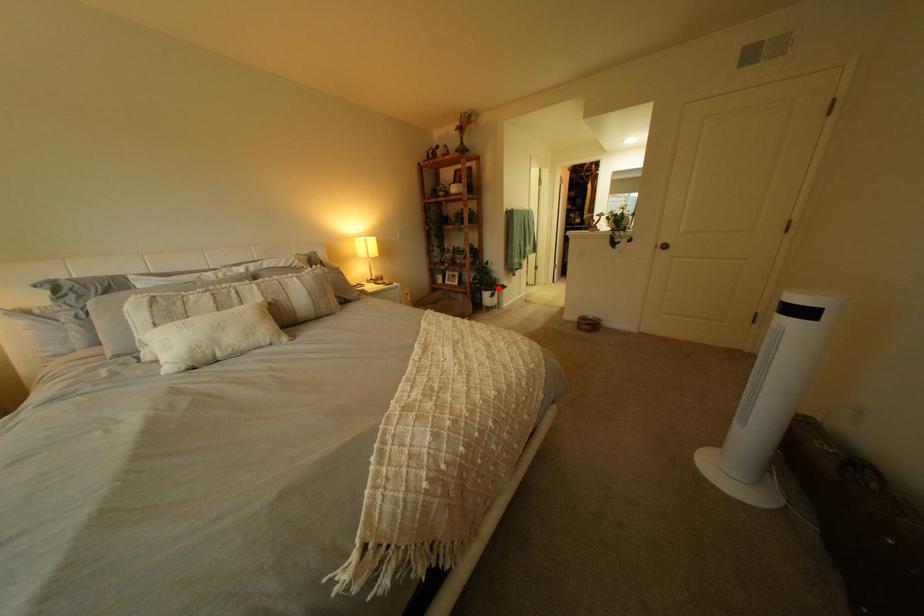
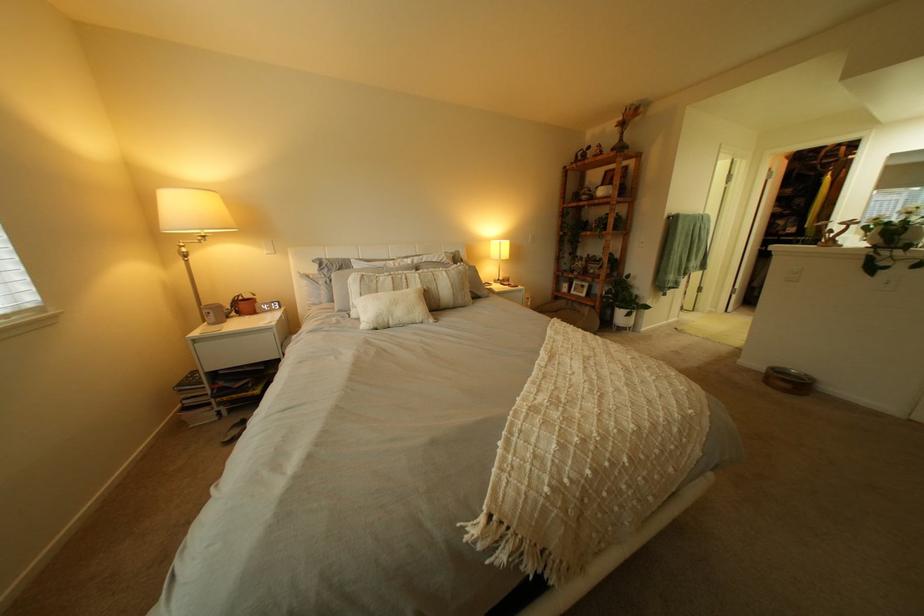
Question: I am providing you with two images of the same scene from different viewpoints. Image1 has a red point marked. In image2, the corresponding 3D location appears at what relative position? Reply with the corresponding letter.

Choices:
 (A) Closer
 (B) Farther

Answer: (B)